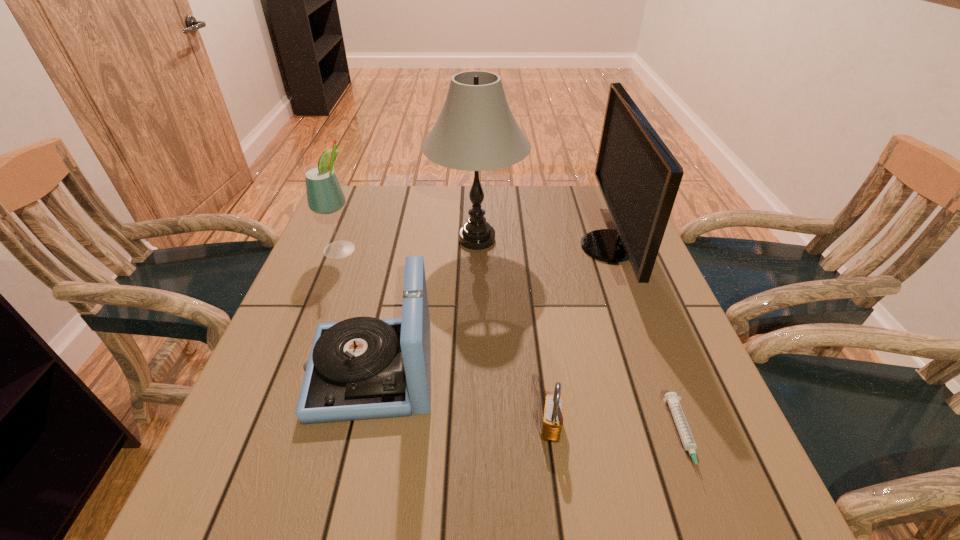
At what (x,y) coordinates should I click in order to perform the action: click on syringe located in the right edge section of the desktop. Please return your answer as a coordinate pair (x, y). Looking at the image, I should click on (671, 398).

The height and width of the screenshot is (540, 960). Identify the location of object present at the far right corner. (639, 178).

The width and height of the screenshot is (960, 540). In order to click on object situated at the near right corner in this screenshot , I will do `click(671, 398)`.

Where is `vacant space at the far edge of the desktop`? vacant space at the far edge of the desktop is located at coordinates (449, 204).

Locate an element on the screen. free point at the near edge is located at coordinates (601, 532).

In order to click on free space at the left edge in this screenshot , I will do `click(288, 325)`.

Image resolution: width=960 pixels, height=540 pixels. I want to click on vacant area at the right edge, so click(591, 261).

You are a GUI agent. You are given a task and a screenshot of the screen. Output one action in this format:
    pyautogui.click(x=<x>, y=<y>)
    Task: Click on the free location at the far left corner of the desktop
    This screenshot has width=960, height=540.
    Given the screenshot: What is the action you would take?
    pyautogui.click(x=358, y=212)

In the image, there is a desktop. Where is `vacant space at the near left corner`? Image resolution: width=960 pixels, height=540 pixels. vacant space at the near left corner is located at coordinates (193, 529).

The width and height of the screenshot is (960, 540). In the image, there is a desktop. In order to click on vacant space at the far right corner in this screenshot , I will do `click(603, 226)`.